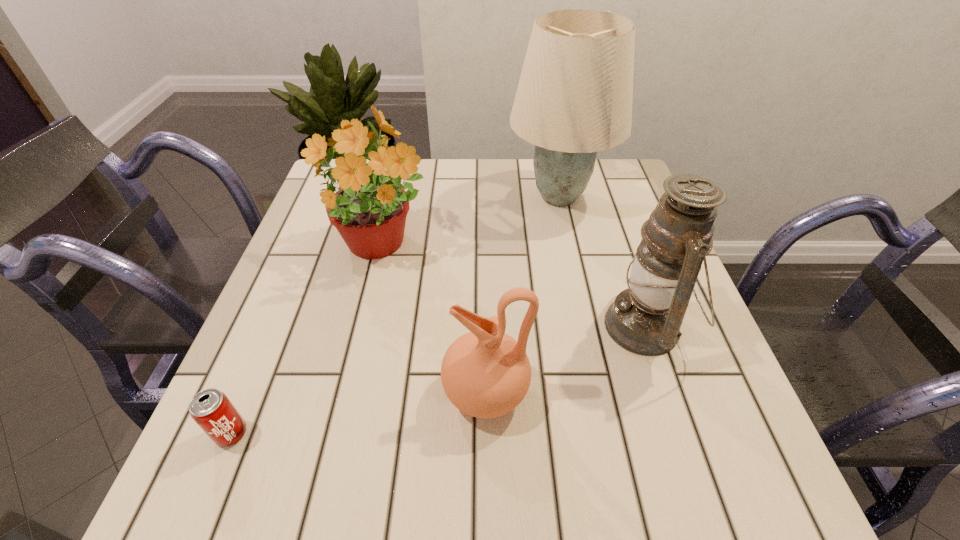
The width and height of the screenshot is (960, 540). What are the coordinates of `free space located 0.110m on the spout of the pottery` in the screenshot? It's located at tap(379, 393).

Image resolution: width=960 pixels, height=540 pixels. Identify the location of vacant space located 0.160m on the spout of the pottery. (350, 393).

This screenshot has height=540, width=960. Find the location of `free point located on the front of the beer can`. free point located on the front of the beer can is located at coordinates (211, 482).

At what (x,y) coordinates should I click in order to perform the action: click on object at the far edge. Please return your answer as a coordinate pair (x, y). The height and width of the screenshot is (540, 960). Looking at the image, I should click on (574, 98).

Image resolution: width=960 pixels, height=540 pixels. I want to click on object that is at the near edge, so click(211, 409).

Find the location of a particular element. flowerpot present at the left edge is located at coordinates (369, 210).

Find the location of a particular element. The height and width of the screenshot is (540, 960). beer can that is at the left edge is located at coordinates (211, 409).

The image size is (960, 540). Identify the location of lampshade that is at the right edge. (574, 98).

Locate an element on the screen. oil lamp at the right edge is located at coordinates (645, 319).

Image resolution: width=960 pixels, height=540 pixels. Find the location of `object that is at the near left corner`. object that is at the near left corner is located at coordinates tap(211, 409).